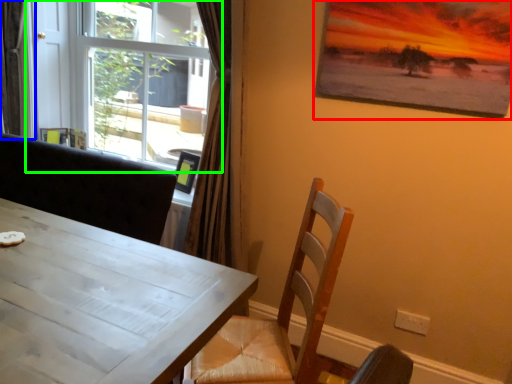
Question: Based on their relative distances, which object is nearer to picture frame (highlighted by a red box)? Choose from curtain (highlighted by a blue box) and window (highlighted by a green box).

Choices:
 (A) curtain
 (B) window

Answer: (B)